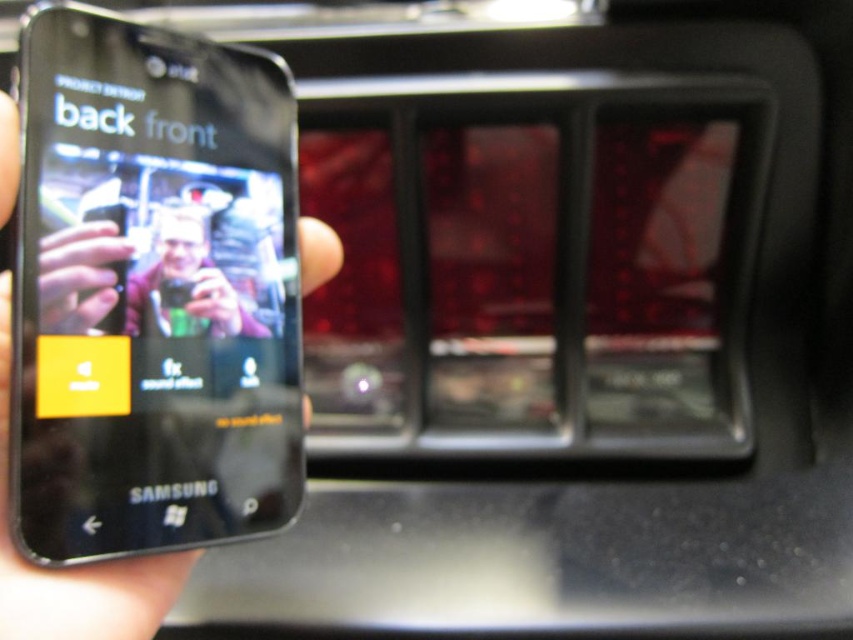
Does black matte phone at left have a greater width compared to matte black phone at left?

Indeed, black matte phone at left has a greater width compared to matte black phone at left.

Is black matte phone at left positioned behind matte black phone at left?

No, it is not.

Locate an element on the screen. The width and height of the screenshot is (853, 640). black matte phone at left is located at coordinates (74, 566).

Does point (83, 64) come closer to viewer compared to point (3, 461)?

No, (83, 64) is further to viewer.

Between black glossy phone at left and black matte phone at left, which one appears on the right side from the viewer's perspective?

Positioned to the right is black glossy phone at left.

This screenshot has width=853, height=640. Find the location of `black glossy phone at left`. black glossy phone at left is located at coordinates (152, 291).

Identify the location of black glossy phone at left. (152, 291).

Does black glossy phone at left appear over matte black phone at left?

Yes, black glossy phone at left is above matte black phone at left.

The width and height of the screenshot is (853, 640). I want to click on black glossy phone at left, so click(x=152, y=291).